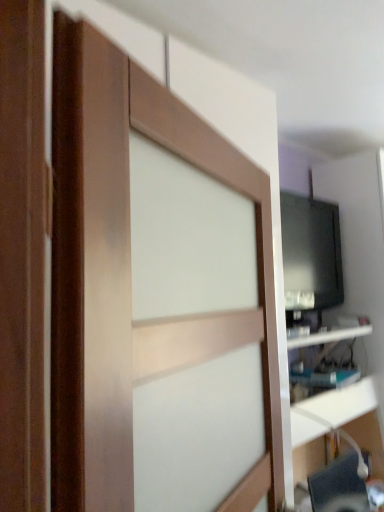
Question: Relative to black glossy tv at upper right, is wooden barn door at center in front or behind?

Choices:
 (A) behind
 (B) front

Answer: (B)

Question: Is wooden barn door at center bigger or smaller than black glossy tv at upper right?

Choices:
 (A) small
 (B) big

Answer: (A)

Question: Which of these objects is positioned closest to the gray fabric computer chair at lower right?

Choices:
 (A) black glossy tv at upper right
 (B) black glossy monitor at right
 (C) wooden barn door at center
 (D) white glossy shelf at right

Answer: (D)

Question: Estimate the real-world distances between objects in this image. Which object is closer to the black glossy tv at upper right?

Choices:
 (A) white glossy shelf at right
 (B) wooden barn door at center
 (C) black glossy monitor at right
 (D) gray fabric computer chair at lower right

Answer: (C)